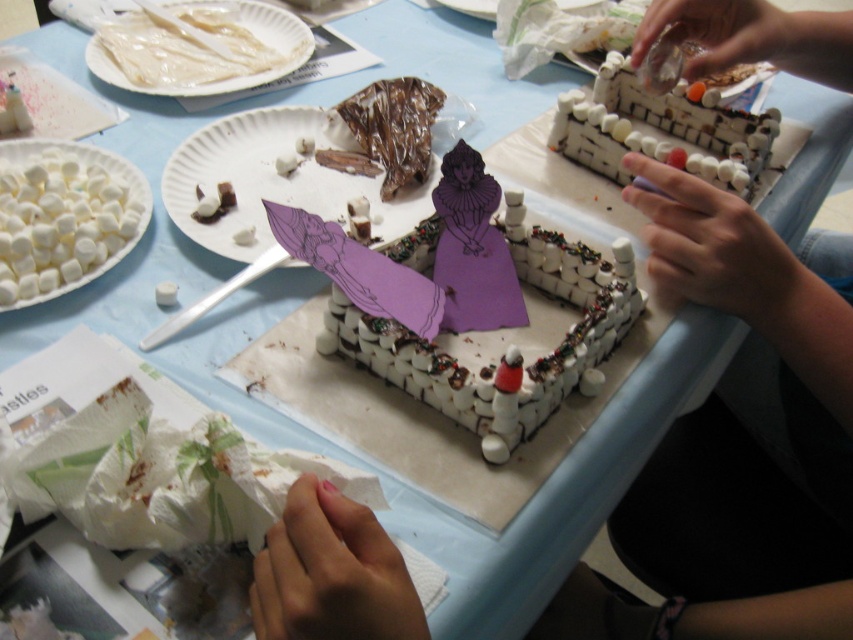
Question: From the image, what is the correct spatial relationship of purple paper cutout at center in relation to white paper plate at center?

Choices:
 (A) above
 (B) below

Answer: (B)

Question: Which object is positioned farthest from the purple paper cutout at center?

Choices:
 (A) white paper plate at upper left
 (B) white marshmallow castle at upper right
 (C) white paper plate at center
 (D) white marshmallow at center

Answer: (A)

Question: Can you confirm if white marshmallows at left is bigger than white marshmallow at center?

Choices:
 (A) yes
 (B) no

Answer: (A)

Question: Among these objects, which one is nearest to the camera?

Choices:
 (A) purple paper cutout at center
 (B) white marshmallow at center

Answer: (A)

Question: Does white paper plate at center lie in front of white marshmallow castle at upper right?

Choices:
 (A) no
 (B) yes

Answer: (B)

Question: Which of the following is the farthest from the observer?

Choices:
 (A) (44, 163)
 (B) (766, 136)
 (C) (296, 118)
 (D) (403, 310)

Answer: (C)